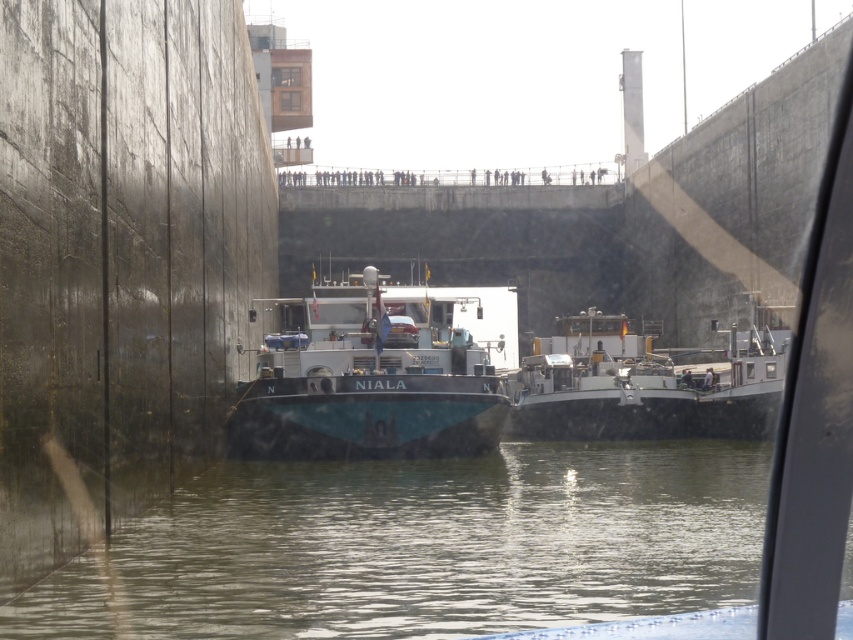
Question: Which point is closer to the camera?

Choices:
 (A) pos(445,401)
 (B) pos(677,516)

Answer: (B)

Question: Is clear water at center positioned at the back of white glossy barge at center?

Choices:
 (A) no
 (B) yes

Answer: (A)

Question: Among these objects, which one is nearest to the camera?

Choices:
 (A) teal matte boat at center
 (B) white glossy barge at center
 (C) clear water at center

Answer: (C)

Question: Which point appears farthest from the camera in this image?

Choices:
 (A) (515, 381)
 (B) (389, 371)

Answer: (A)

Question: In this image, where is clear water at center located relative to white glossy barge at center?

Choices:
 (A) below
 (B) above

Answer: (A)

Question: Is clear water at center positioned behind teal matte boat at center?

Choices:
 (A) no
 (B) yes

Answer: (A)